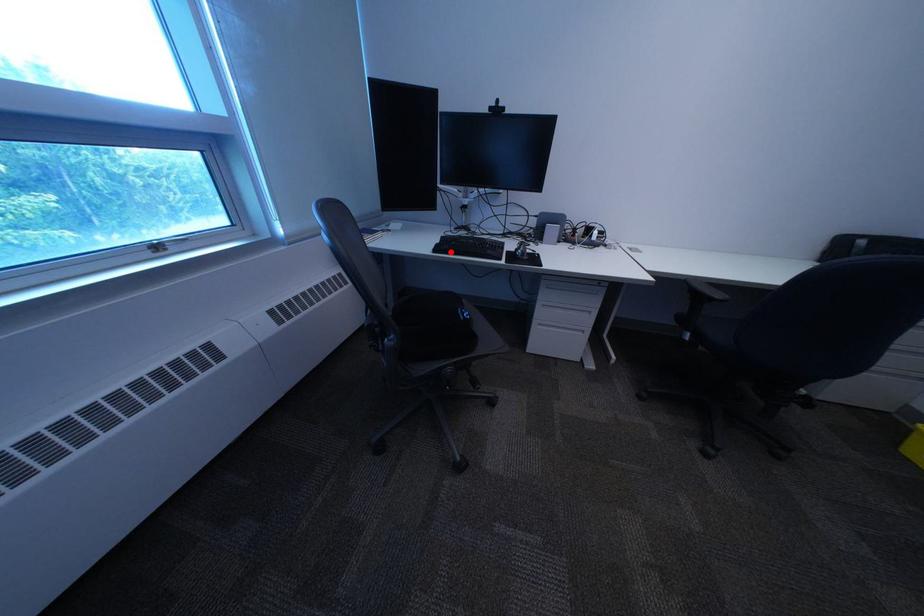
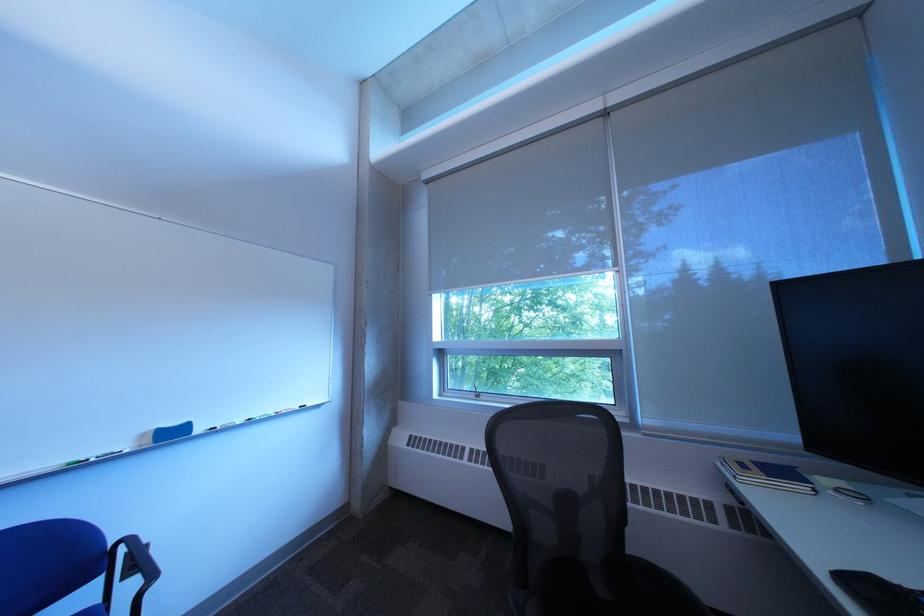
Locate, in the second image, the point that corresponds to the highlighted location in the first image.

(860, 582)